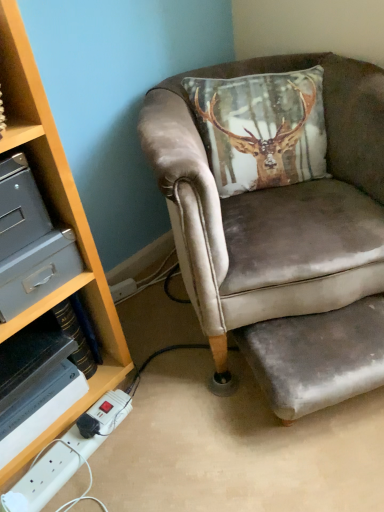
Locate an element on the screen. metallic gray drawer at left is located at coordinates (38, 271).

Measure the distance between point (50, 460) and camera.

They are 39.06 inches apart.

This screenshot has height=512, width=384. I want to click on velvet grey footrest at lower right, so click(317, 357).

The width and height of the screenshot is (384, 512). What are the coordinates of `metallic gray drawer at left` in the screenshot? It's located at (38, 271).

Is white plastic power strip at lower left positioned with its back to velvet brown armchair at center?

No, white plastic power strip at lower left's orientation is not away from velvet brown armchair at center.

Which is less distant, (60, 456) or (375, 68)?

The point (60, 456) is more forward.

Can we say white plastic power strip at lower left lies outside velvet brown armchair at center?

Yes, white plastic power strip at lower left is outside of velvet brown armchair at center.

From the image's perspective, which one is positioned lower, white plastic power strip at lower left or velvet brown armchair at center?

From the image's view, white plastic power strip at lower left is below.

Is velvet grey footrest at lower right far away from velvet brown armchair at center?

No, there isn't a large distance between velvet grey footrest at lower right and velvet brown armchair at center.

Image resolution: width=384 pixels, height=512 pixels. I want to click on chair on the left of velvet grey footrest at lower right, so click(285, 240).

Is velvet grey footrest at lower right to the right of velvet brown armchair at center from the viewer's perspective?

Yes.

Considering the sizes of objects velvet grey footrest at lower right and velvet brown armchair at center in the image provided, who is shorter, velvet grey footrest at lower right or velvet brown armchair at center?

Standing shorter between the two is velvet grey footrest at lower right.

From the picture: Who is shorter, metallic gray drawer at left or velvet brown armchair at center?

metallic gray drawer at left is shorter.

This screenshot has height=512, width=384. In order to click on drawer behind the velvet brown armchair at center in this screenshot , I will do `click(38, 271)`.

Is velvet brown armchair at center inside metallic gray drawer at left?

That's incorrect, velvet brown armchair at center is not inside metallic gray drawer at left.

From a real-world perspective, is metallic gray drawer at left below velvet brown armchair at center?

No.

From the image's perspective, is velvet brown armchair at center above or below velvet grey footrest at lower right?

Based on their image positions, velvet brown armchair at center is located above velvet grey footrest at lower right.

From a real-world perspective, does velvet brown armchair at center sit lower than velvet grey footrest at lower right?

Actually, velvet brown armchair at center is physically above velvet grey footrest at lower right in the real world.

Is velvet brown armchair at center oriented towards velvet grey footrest at lower right?

Yes, velvet brown armchair at center is turned towards velvet grey footrest at lower right.

From a real-world perspective, is white plastic power strip at lower left physically located above or below metallic gray drawer at left?

white plastic power strip at lower left is situated lower than metallic gray drawer at left in the real world.

Which object is wider, white plastic power strip at lower left or metallic gray drawer at left?

With larger width is metallic gray drawer at left.

Does white plastic power strip at lower left have a larger size compared to metallic gray drawer at left?

No, white plastic power strip at lower left is not bigger than metallic gray drawer at left.

Is velvet grey footrest at lower right beside metallic gray drawer at left?

No, velvet grey footrest at lower right is not next to metallic gray drawer at left.

Which is more to the left, velvet grey footrest at lower right or metallic gray drawer at left?

Positioned to the left is metallic gray drawer at left.

Is point (295, 334) behind point (34, 286)?

Yes.

Which of these two, velvet grey footrest at lower right or metallic gray drawer at left, is smaller?

Smaller between the two is metallic gray drawer at left.

Is the surface of velvet brown armchair at center in direct contact with metallic gray drawer at left?

velvet brown armchair at center is not next to metallic gray drawer at left, and they're not touching.

How many degrees apart are the facing directions of velvet brown armchair at center and metallic gray drawer at left?

36.4 degrees.

Which of these two, velvet brown armchair at center or metallic gray drawer at left, is wider?

With larger width is velvet brown armchair at center.

The width and height of the screenshot is (384, 512). In order to click on chair lying above the white plastic power strip at lower left (from the image's perspective) in this screenshot , I will do `click(285, 240)`.

Identify the location of chair that appears on the left of velvet grey footrest at lower right. (285, 240).

Estimate the real-world distances between objects in this image. Which object is further from white plastic power strip at lower left, metallic gray drawer at left or velvet brown armchair at center?

velvet brown armchair at center lies further to white plastic power strip at lower left than the other object.

Based on their spatial positions, is velvet grey footrest at lower right or white plastic power strip at lower left further from metallic gray drawer at left?

Among the two, velvet grey footrest at lower right is located further to metallic gray drawer at left.

Which object lies nearer to the anchor point velvet brown armchair at center, metallic gray drawer at left or velvet grey footrest at lower right?

Among the two, velvet grey footrest at lower right is located nearer to velvet brown armchair at center.

Looking at this image, estimate the real-world distances between objects in this image. Which object is closer to white plastic power strip at lower left, metallic gray drawer at left or velvet grey footrest at lower right?

metallic gray drawer at left is closer to white plastic power strip at lower left.

Based on their spatial positions, is velvet brown armchair at center or white plastic power strip at lower left further from velvet grey footrest at lower right?

white plastic power strip at lower left lies further to velvet grey footrest at lower right than the other object.

When comparing their distances from velvet brown armchair at center, does white plastic power strip at lower left or metallic gray drawer at left seem closer?

metallic gray drawer at left is positioned closer to the anchor velvet brown armchair at center.

In the scene shown: Considering their positions, is metallic gray drawer at left positioned further to velvet grey footrest at lower right than white plastic power strip at lower left?

The object further to velvet grey footrest at lower right is metallic gray drawer at left.

Looking at the image, which one is located closer to velvet brown armchair at center, velvet grey footrest at lower right or metallic gray drawer at left?

velvet grey footrest at lower right is closer to velvet brown armchair at center.

Identify the location of chair located between metallic gray drawer at left and velvet grey footrest at lower right in the left-right direction. (285, 240).

Where is `power outlet between metallic gray drawer at left and velvet grey footrest at lower right in the horizontal direction`? power outlet between metallic gray drawer at left and velvet grey footrest at lower right in the horizontal direction is located at coordinates (43, 480).

Find the location of `chair located between white plastic power strip at lower left and velvet grey footrest at lower right in the left-right direction`. chair located between white plastic power strip at lower left and velvet grey footrest at lower right in the left-right direction is located at coordinates (285, 240).

At what (x,y) coordinates should I click in order to perform the action: click on power outlet situated between metallic gray drawer at left and velvet brown armchair at center from left to right. Please return your answer as a coordinate pair (x, y). Image resolution: width=384 pixels, height=512 pixels. Looking at the image, I should click on (43, 480).